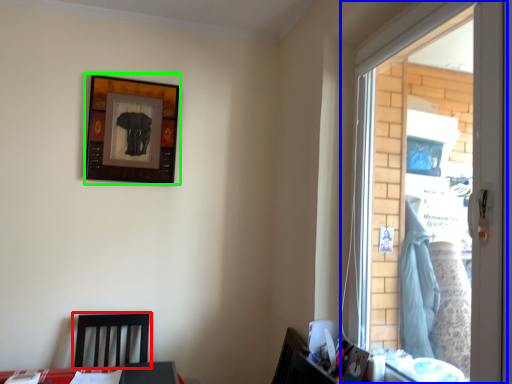
Question: Which object is positioned farthest from furniture (highlighted by a red box)? Select from window (highlighted by a blue box) and picture frame (highlighted by a green box).

Choices:
 (A) window
 (B) picture frame

Answer: (A)